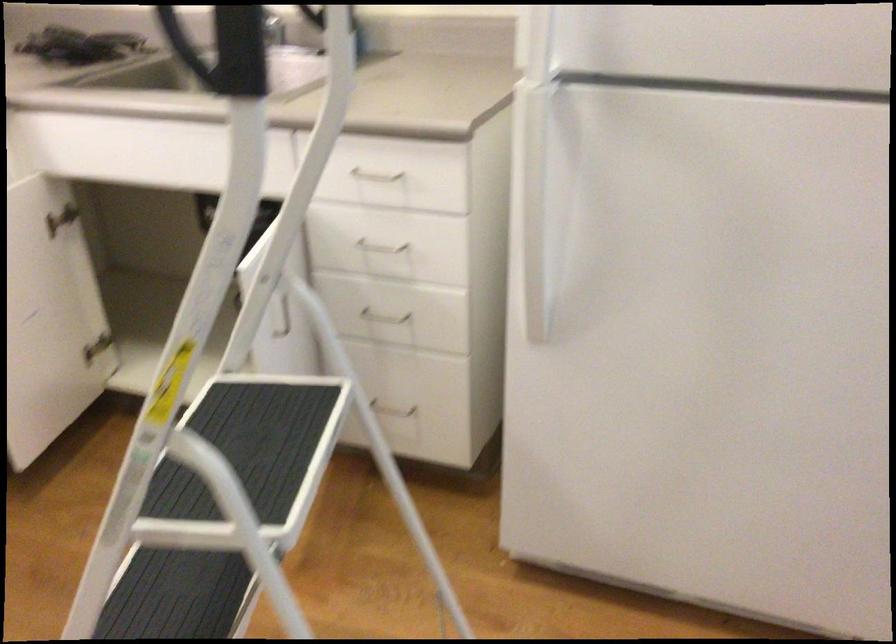
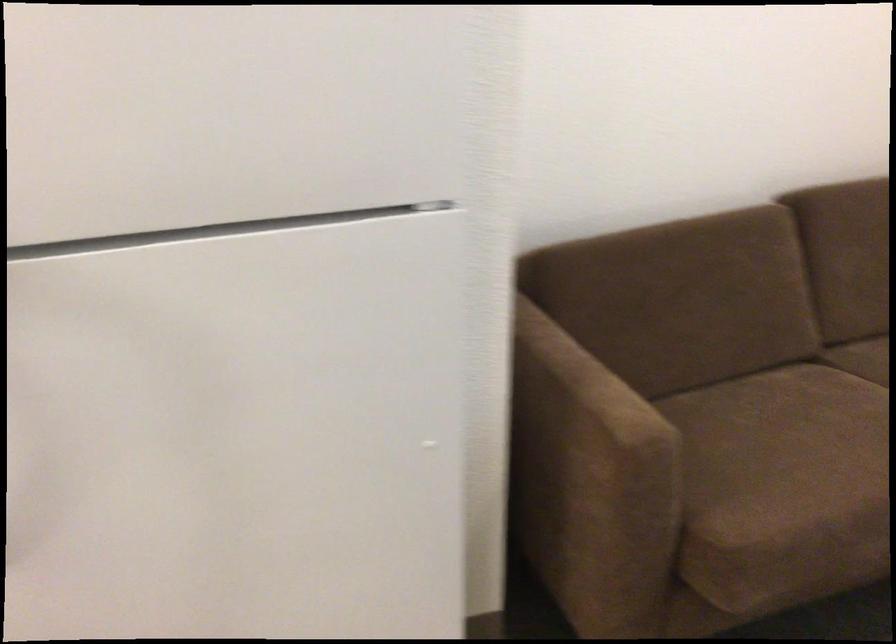
Question: The camera is either moving clockwise (left) or counter-clockwise (right) around the object. The first image is from the beginning of the video and the second image is from the end. Is the camera moving left or right when shooting the video?

Choices:
 (A) Left
 (B) Right

Answer: (A)